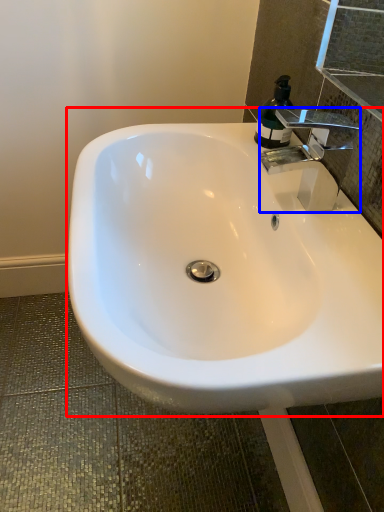
Question: Which of the following is the farthest to the observer, sink (highlighted by a red box) or tap (highlighted by a blue box)?

Choices:
 (A) sink
 (B) tap

Answer: (B)